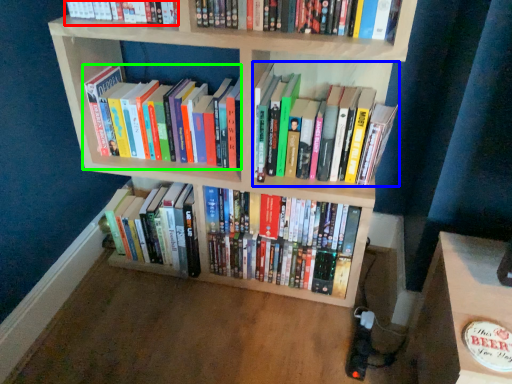
Question: Which object is positioned farthest from book (highlighted by a red box)? Select from book (highlighted by a blue box) and book (highlighted by a green box).

Choices:
 (A) book
 (B) book

Answer: (A)